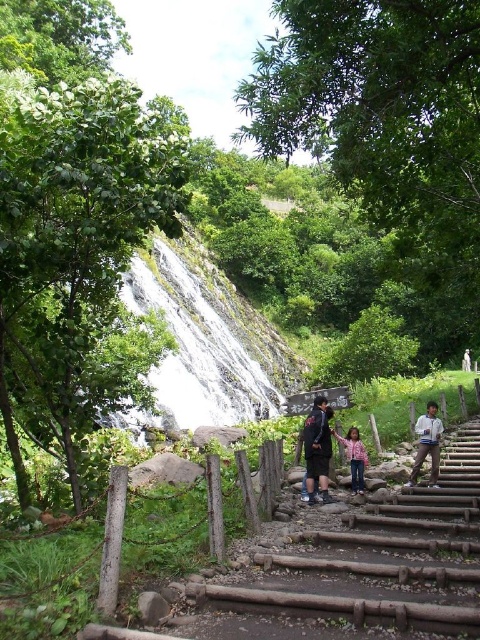
Question: Which point is farther to the camera?

Choices:
 (A) (134, 312)
 (B) (416, 477)
 (C) (336, 433)
 (D) (322, 460)

Answer: (A)

Question: Can you confirm if dark blue fabric jacket at center is positioned above white cotton jacket at lower right?

Choices:
 (A) no
 (B) yes

Answer: (B)

Question: Does white textured waterfall at center appear on the left side of dark blue fabric jacket at center?

Choices:
 (A) no
 (B) yes

Answer: (B)

Question: Among these objects, which one is nearest to the camera?

Choices:
 (A) dark blue fabric jacket at center
 (B) pink cotton shirt at center
 (C) white cotton jacket at lower right

Answer: (A)

Question: Does dark blue fabric jacket at center appear under white cotton jacket at lower right?

Choices:
 (A) no
 (B) yes

Answer: (A)

Question: Which of the following is the farthest from the observer?

Choices:
 (A) (275, 388)
 (B) (351, 468)

Answer: (A)